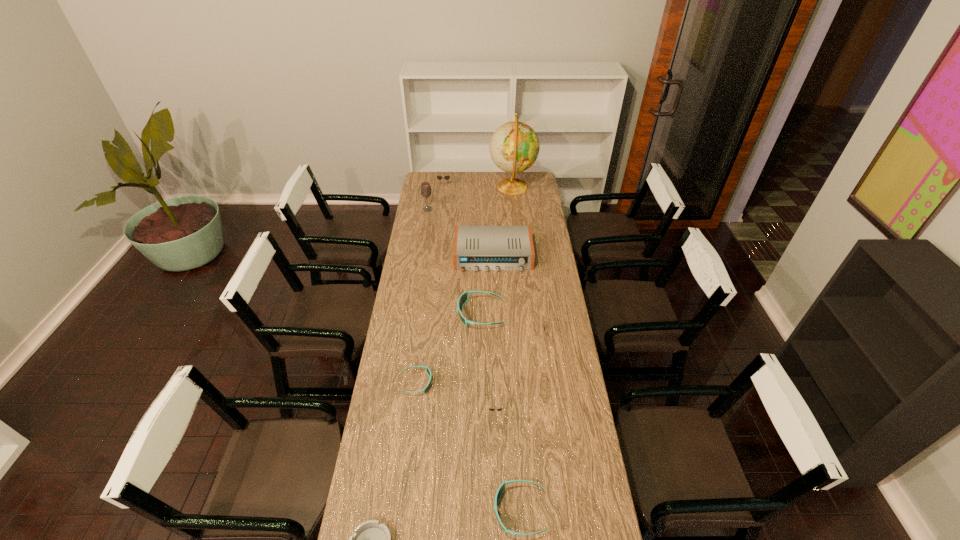
Point out which sunglasses is positioned as the third nearest to the biggest cyan sunglasses. Please provide its 2D coordinates. Your answer should be formatted as a tuple, i.e. [(x, y)], where the tuple contains the x and y coordinates of a point satisfying the conditions above.

[(491, 409)]

Identify which black sunglasses is located as the third nearest to the biggest cyan sunglasses. Please provide its 2D coordinates. Your answer should be formatted as a tuple, i.e. [(x, y)], where the tuple contains the x and y coordinates of a point satisfying the conditions above.

[(438, 177)]

This screenshot has height=540, width=960. What are the coordinates of `the second closest black sunglasses to the second nearest sunglasses` in the screenshot? It's located at (438, 177).

Point out which cyan sunglasses is positioned as the third nearest to the globe. Please provide its 2D coordinates. Your answer should be formatted as a tuple, i.e. [(x, y)], where the tuple contains the x and y coordinates of a point satisfying the conditions above.

[(502, 487)]

The height and width of the screenshot is (540, 960). Find the location of `cyan sunglasses that is the closest to the biggest cyan sunglasses`. cyan sunglasses that is the closest to the biggest cyan sunglasses is located at coordinates (428, 370).

This screenshot has width=960, height=540. I want to click on free location that satisfies the following two spatial constraints: 1. on the front side of the globe; 2. on the front-facing side of the nearest cyan sunglasses, so click(545, 511).